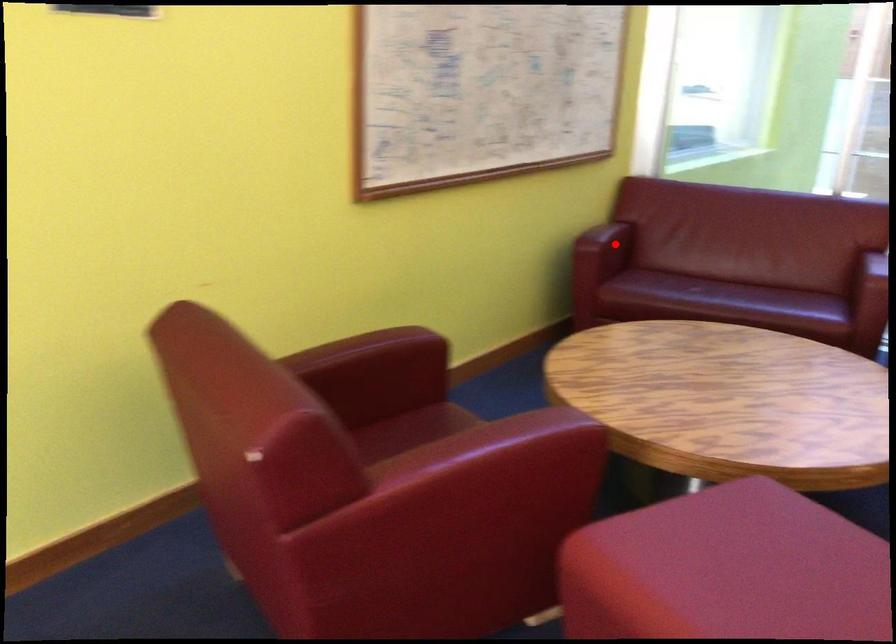
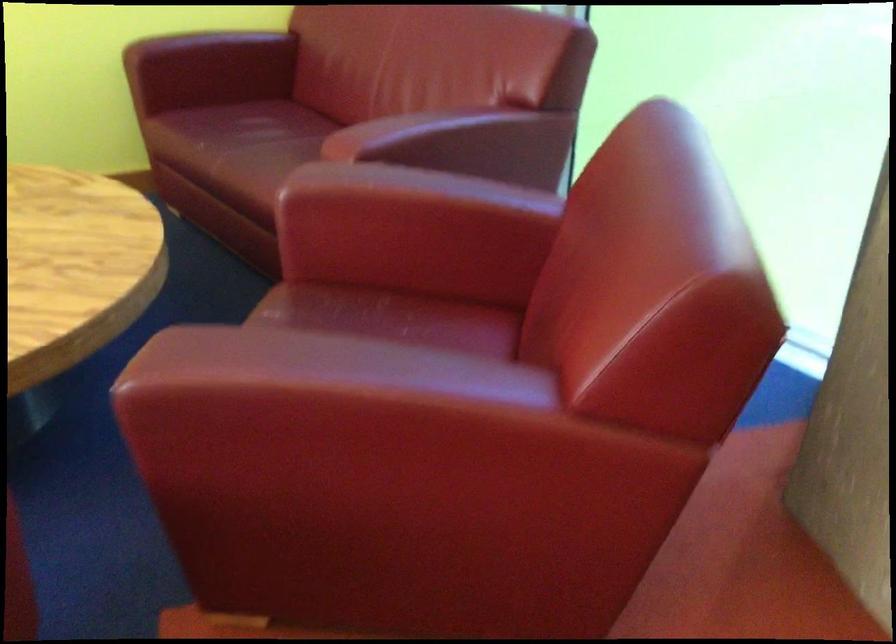
Locate, in the second image, the point that corresponds to the highlighted location in the first image.

(208, 69)